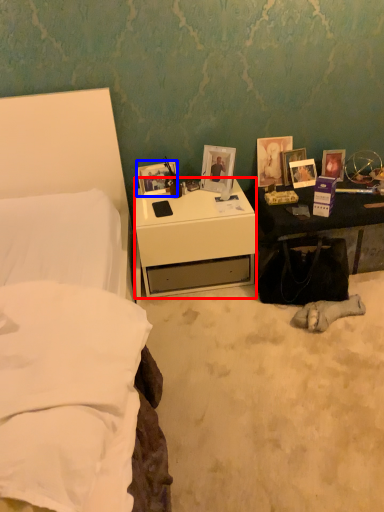
Question: Which of the following is the farthest to the observer, desk (highlighted by a red box) or picture frame (highlighted by a blue box)?

Choices:
 (A) desk
 (B) picture frame

Answer: (B)